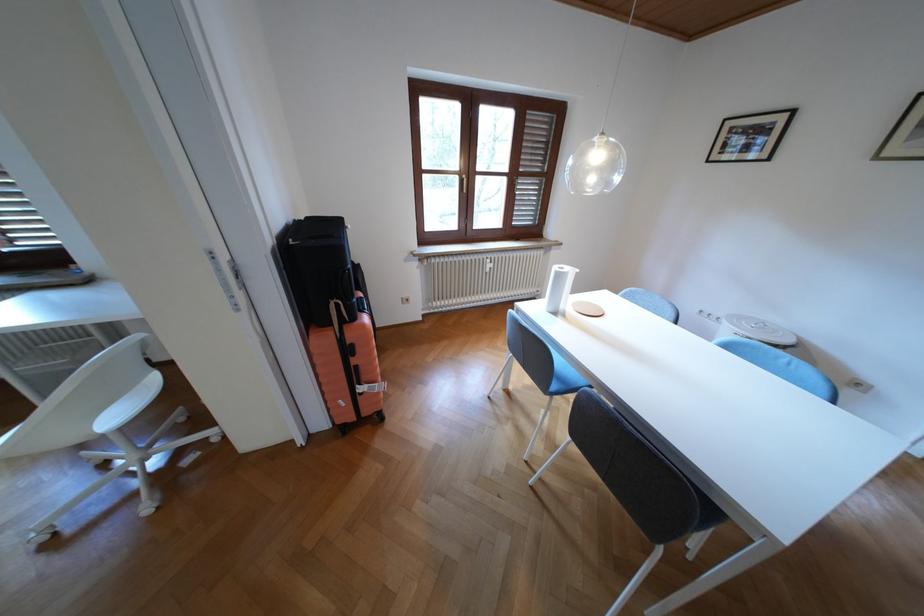
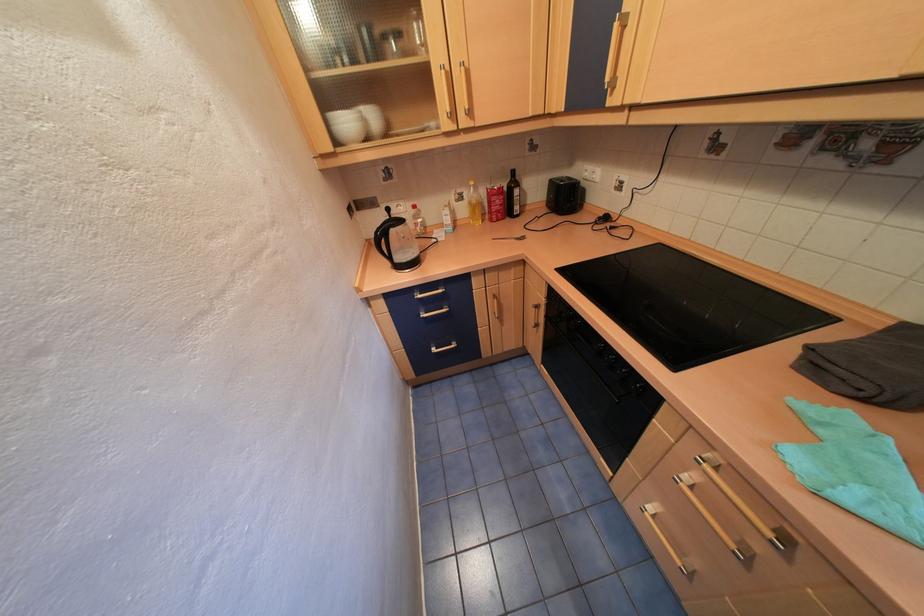
Looking at this image, in a continuous first-person perspective shot, in which direction is the camera moving?

The cameraman moved toward right, forward.